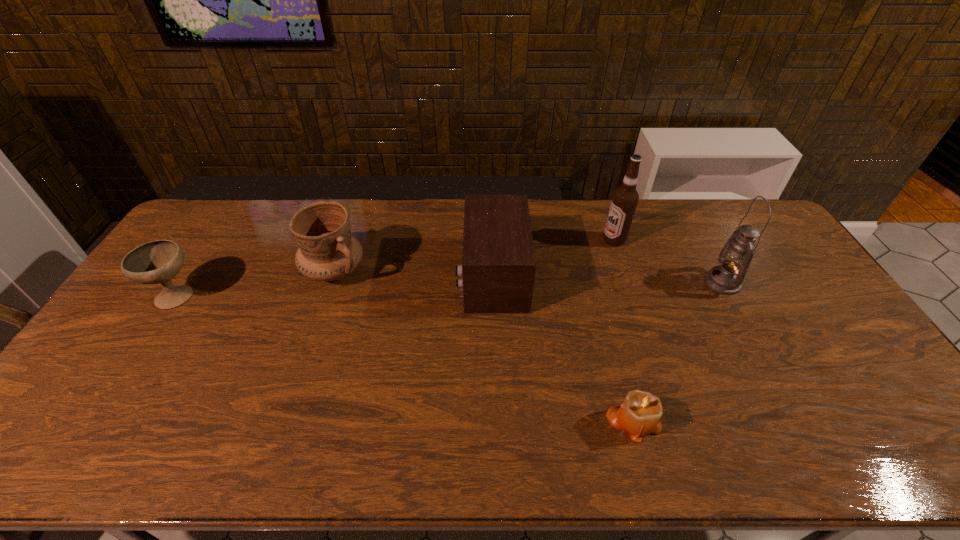
This screenshot has width=960, height=540. In order to click on free space that satisfies the following two spatial constraints: 1. on the label of the alcohol; 2. on the front side of the nearest object in this screenshot , I will do `click(674, 420)`.